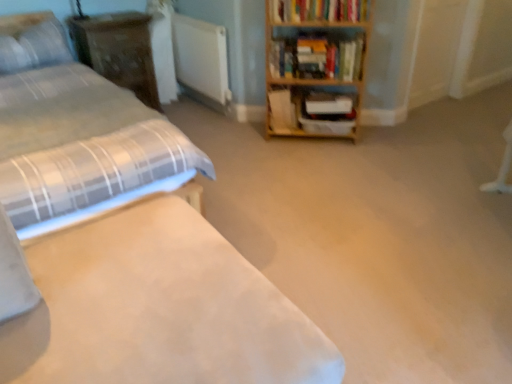
Question: Is white matte radiator at center at the left side of hardcover book at upper right, which is the third book in bottom-to-top order?

Choices:
 (A) no
 (B) yes

Answer: (B)

Question: Would you say white matte radiator at center contains hardcover book at upper right, which is the third book in bottom-to-top order?

Choices:
 (A) yes
 (B) no

Answer: (B)

Question: Is white matte radiator at center outside hardcover book at upper right, which is the third book in bottom-to-top order?

Choices:
 (A) no
 (B) yes

Answer: (B)

Question: From the image's perspective, is white matte radiator at center over hardcover book at upper right, which is the third book in bottom-to-top order?

Choices:
 (A) no
 (B) yes

Answer: (A)

Question: Is white matte radiator at center in front of hardcover book at upper right, which is the third book in bottom-to-top order?

Choices:
 (A) yes
 (B) no

Answer: (B)

Question: From a real-world perspective, is white matte radiator at center on hardcover book at upper right, which is the third book in bottom-to-top order?

Choices:
 (A) no
 (B) yes

Answer: (A)

Question: Is wooden bookshelf at upper right, the 2th book positioned from the bottom, outside of wooden bookcase at upper right?

Choices:
 (A) yes
 (B) no

Answer: (B)

Question: Does wooden bookshelf at upper right, the second book in the top-to-bottom sequence, appear on the right side of wooden bookcase at upper right?

Choices:
 (A) no
 (B) yes

Answer: (B)

Question: Is wooden bookshelf at upper right, the second book in the top-to-bottom sequence, facing away from wooden bookcase at upper right?

Choices:
 (A) no
 (B) yes

Answer: (B)

Question: Is wooden bookshelf at upper right, the 2th book positioned from the bottom, aimed at wooden bookcase at upper right?

Choices:
 (A) yes
 (B) no

Answer: (A)

Question: Is wooden bookshelf at upper right, the 2th book positioned from the bottom, touching wooden bookcase at upper right?

Choices:
 (A) no
 (B) yes

Answer: (B)

Question: Is wooden bookshelf at upper right, the second book in the top-to-bottom sequence, positioned behind wooden bookcase at upper right?

Choices:
 (A) no
 (B) yes

Answer: (B)

Question: Is wooden shelf at center not near hardcover book at upper right, which ranks as the 1th book in top-to-bottom order?

Choices:
 (A) no
 (B) yes

Answer: (A)